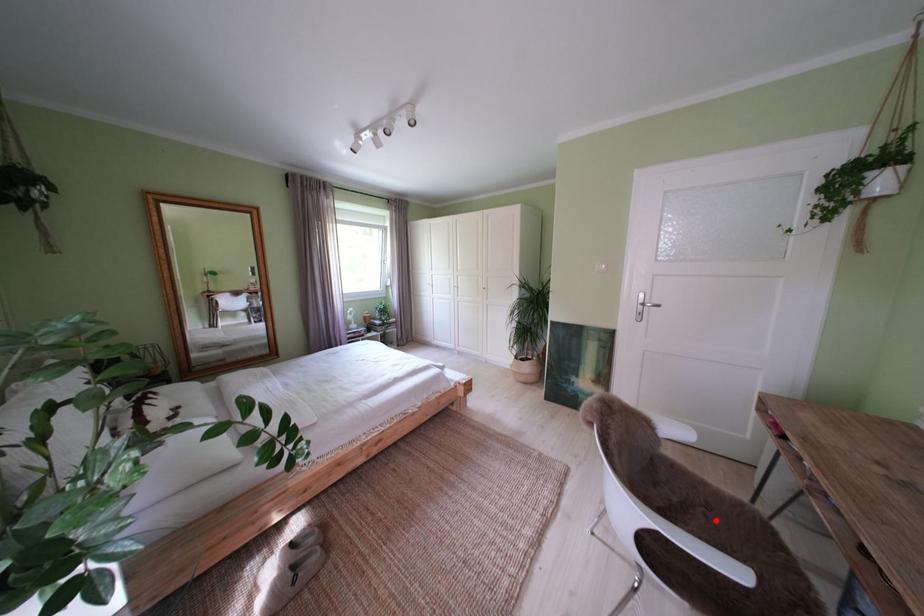
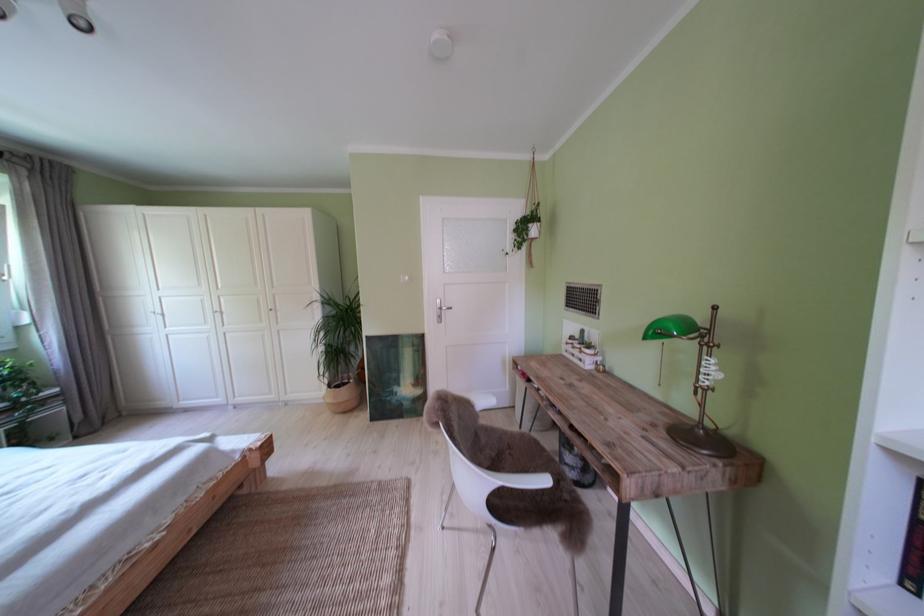
In the second image, find the point that corresponds to the highlighted location in the first image.

(521, 459)